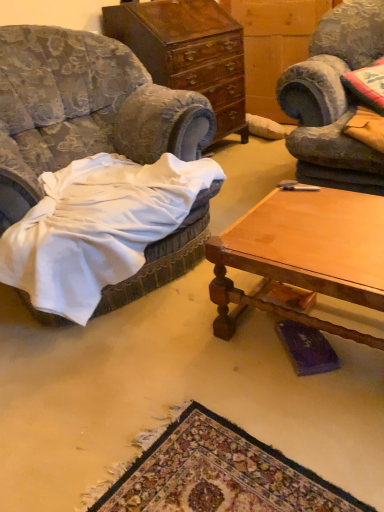
Find the location of `free region on the left part of wooden polished coffee table at center`. free region on the left part of wooden polished coffee table at center is located at coordinates (183, 367).